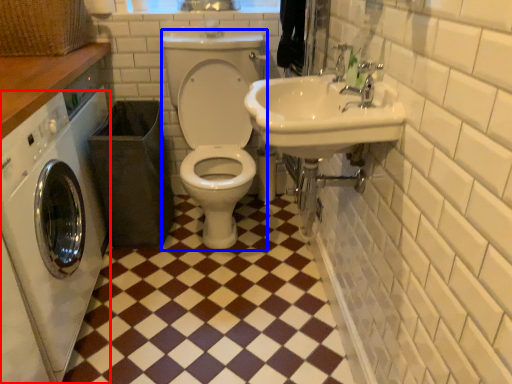
Question: Which of the following is the closest to the observer, washing machine (highlighted by a red box) or squat (highlighted by a blue box)?

Choices:
 (A) washing machine
 (B) squat

Answer: (A)